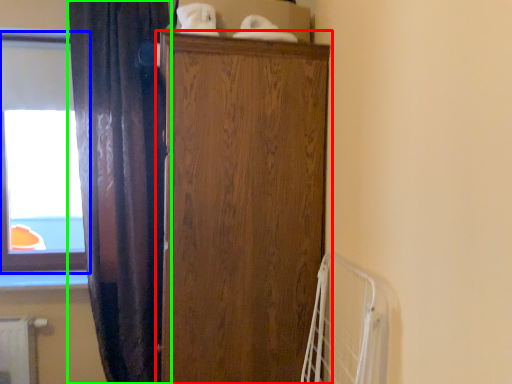
Question: Based on their relative distances, which object is nearer to cupboard (highlighted by a red box)? Choose from window (highlighted by a blue box) and curtain (highlighted by a green box).

Choices:
 (A) window
 (B) curtain

Answer: (B)